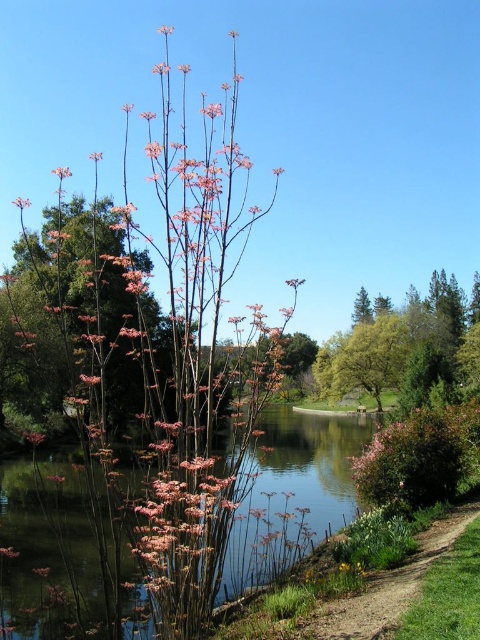
Question: Which point appears closest to the camera in this image?

Choices:
 (A) (300, 490)
 (B) (165, 28)

Answer: (B)

Question: Which object is closer to the camera taking this photo?

Choices:
 (A) clear water at center
 (B) pink matte flower at upper center

Answer: (A)

Question: Does clear water at center have a larger size compared to pink matte flower at upper center?

Choices:
 (A) no
 (B) yes

Answer: (A)

Question: Does clear water at center lie behind pink matte flower at upper center?

Choices:
 (A) yes
 (B) no

Answer: (B)

Question: Is clear water at center closer to the viewer compared to pink matte flower at upper center?

Choices:
 (A) no
 (B) yes

Answer: (B)